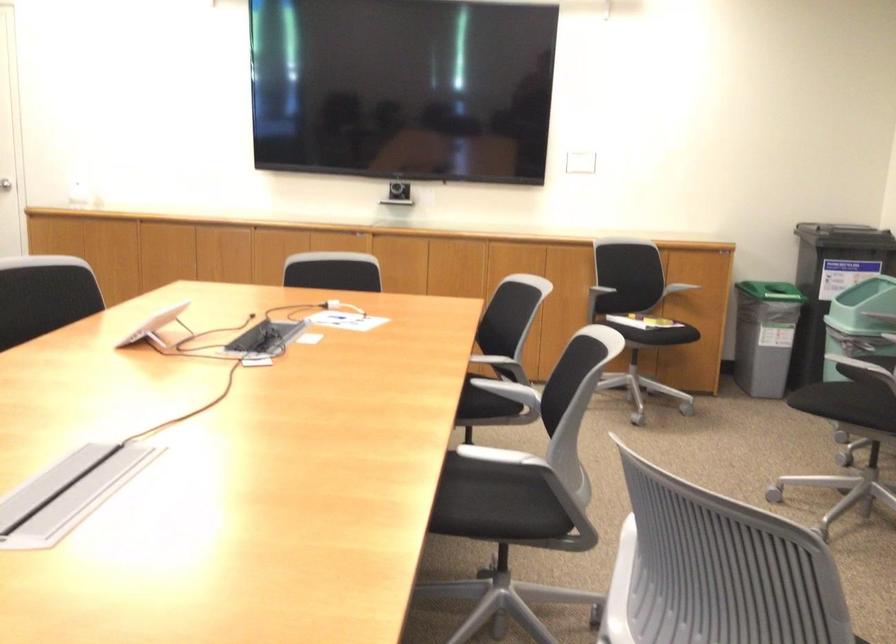
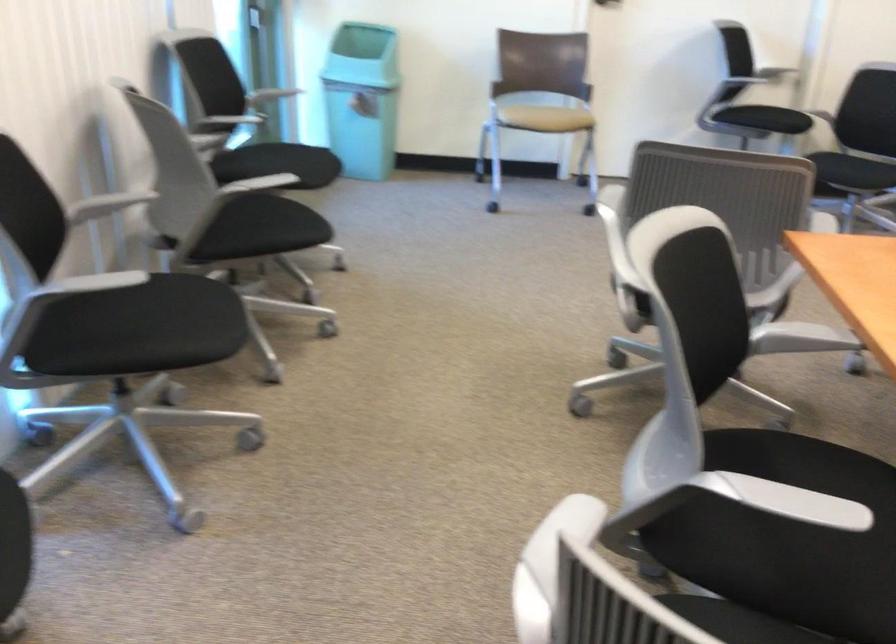
First-person continuous shooting, in which direction is the camera rotating?

The camera rotated toward left-down.